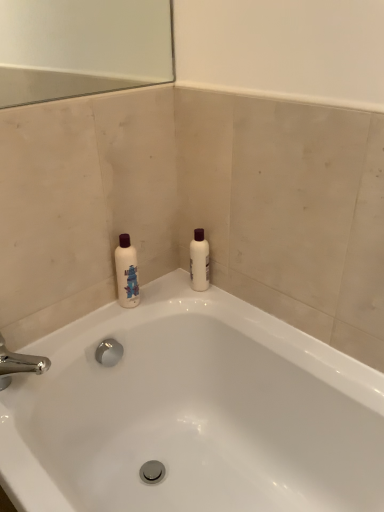
Locate an element on the screen. Image resolution: width=384 pixels, height=512 pixels. free space on the front side of white matte bottle at upper right is located at coordinates (224, 305).